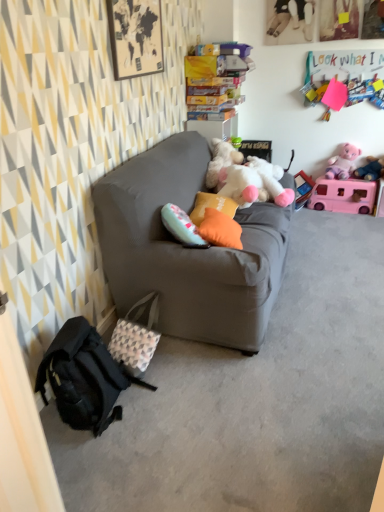
Find the location of `free space to the right of matte gray couch at center`. free space to the right of matte gray couch at center is located at coordinates (332, 280).